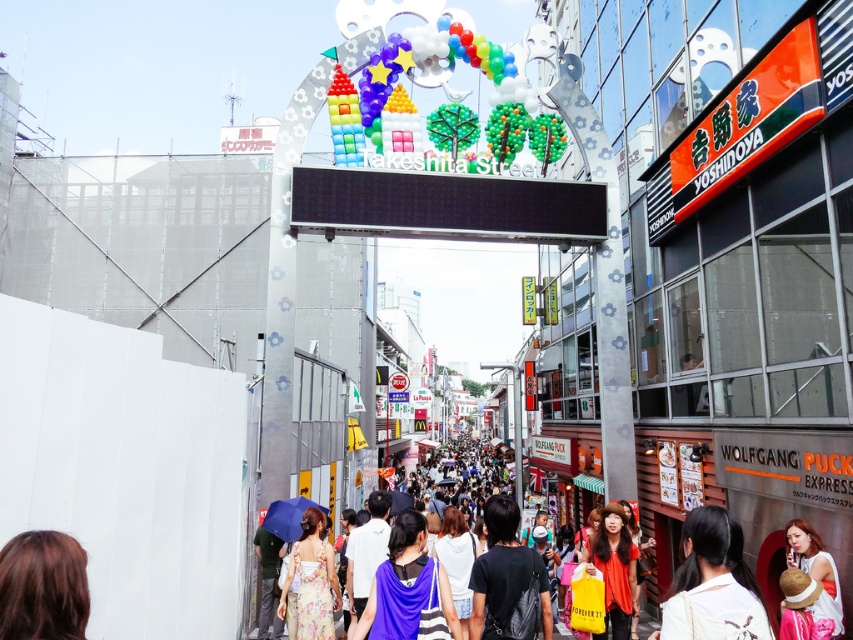
You are standing at the entrance of Takeshita Street and want to take a photo of the archway. There are two points marked on the ground where you can stand. The first is at point [780,534] and the second is at point [613,624]. Which point is closer to the archway entrance?

Point [780,534] is closer to the archway entrance because it is in front of point [613,624].

Consider the image. You are a photographer taking a picture of the decorative archway at the entrance of Takeshita Street. You notice a brown hair at lower left and a purple fabric bag at center in your frame. Which object should you adjust your camera focus to ensure both are in focus, considering their sizes?

The brown hair at lower left is smaller than the purple fabric bag at center, so you should focus on the purple fabric bag at center to ensure both are in focus since it is larger and more prominent in the frame.

You are a photographer standing in front of the decorative archway on Takeshita Street. You notice a person with brown hair at lower left and a purple fabric bag at center in your frame. Which object is covering the other in the image?

The brown hair at lower left is positioned over the purple fabric bag at center, so it is covering the purple fabric bag at center.